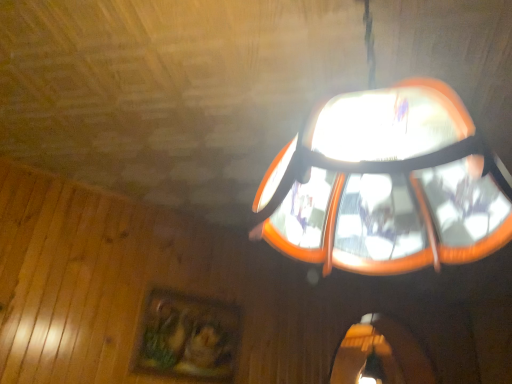
Question: From the image's perspective, relative to orange plastic lampshade at upper center, is wooden painted picture frame at lower left above or below?

Choices:
 (A) above
 (B) below

Answer: (B)

Question: From their relative heights in the image, would you say wooden painted picture frame at lower left is taller or shorter than orange plastic lampshade at upper center?

Choices:
 (A) short
 (B) tall

Answer: (A)

Question: Relative to orange plastic lampshade at upper center, is wooden painted picture frame at lower left in front or behind?

Choices:
 (A) behind
 (B) front

Answer: (A)

Question: Based on their positions, is orange plastic lampshade at upper center located to the left or right of wooden painted picture frame at lower left?

Choices:
 (A) left
 (B) right

Answer: (B)

Question: From their relative heights in the image, would you say orange plastic lampshade at upper center is taller or shorter than wooden painted picture frame at lower left?

Choices:
 (A) short
 (B) tall

Answer: (B)

Question: Is orange plastic lampshade at upper center in front of or behind wooden painted picture frame at lower left in the image?

Choices:
 (A) behind
 (B) front

Answer: (B)

Question: Which is correct: orange plastic lampshade at upper center is inside wooden painted picture frame at lower left, or outside of it?

Choices:
 (A) outside
 (B) inside

Answer: (A)